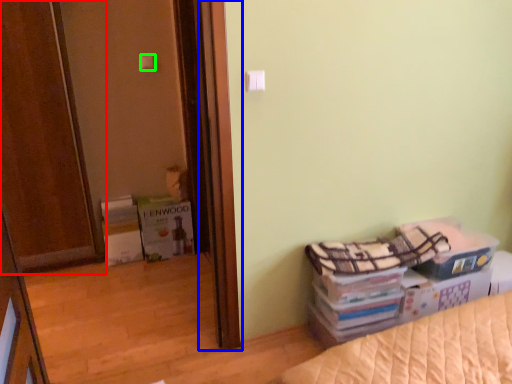
Question: Which object is the closest to the door (highlighted by a red box)? Choose among these: screen door (highlighted by a blue box) or light switch (highlighted by a green box).

Choices:
 (A) screen door
 (B) light switch

Answer: (B)